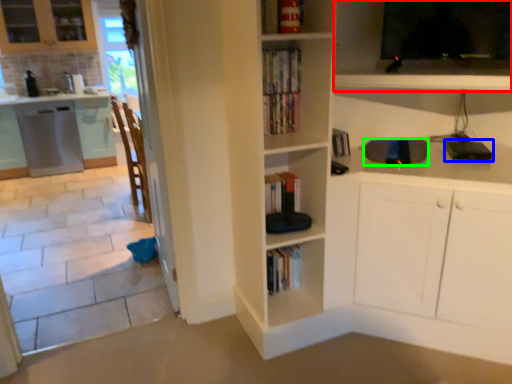
Question: Which object is the closest to the shelf (highlighted by a red box)? Choose among these: appliance (highlighted by a blue box) or appliance (highlighted by a green box).

Choices:
 (A) appliance
 (B) appliance

Answer: (B)